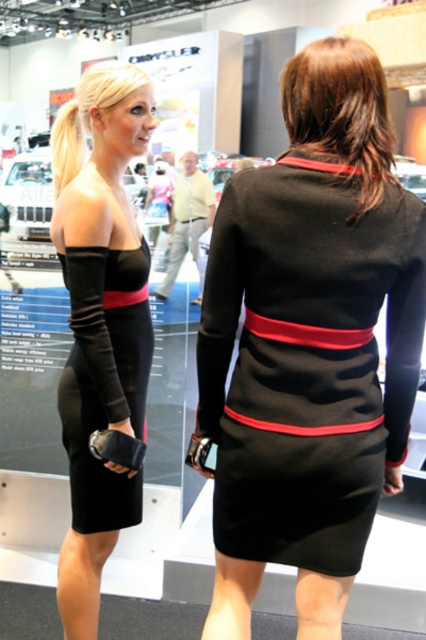
Which is behind, point (284, 493) or point (146, 285)?

Positioned behind is point (146, 285).

Is point (258, 310) closer to viewer compared to point (103, 502)?

Yes, point (258, 310) is closer to viewer.

Is point (394, 436) more distant than point (74, 438)?

No, (394, 436) is closer to viewer.

Where is `black matte dress at center`? The width and height of the screenshot is (426, 640). black matte dress at center is located at coordinates (310, 342).

Who is positioned more to the left, matte black dress at left or yellow cotton shirt at center?

matte black dress at left

Is matte black dress at left positioned behind yellow cotton shirt at center?

No, matte black dress at left is closer to the viewer.

What do you see at coordinates (100, 321) in the screenshot? This screenshot has height=640, width=426. I see `matte black dress at left` at bounding box center [100, 321].

In order to click on matte black dress at left in this screenshot , I will do `click(100, 321)`.

Can you confirm if black satin dress at center is bigger than yellow cotton shirt at center?

Actually, black satin dress at center might be smaller than yellow cotton shirt at center.

From the picture: Who is positioned more to the right, black satin dress at center or yellow cotton shirt at center?

Positioned to the right is yellow cotton shirt at center.

The image size is (426, 640). In order to click on black satin dress at center in this screenshot , I will do `click(104, 378)`.